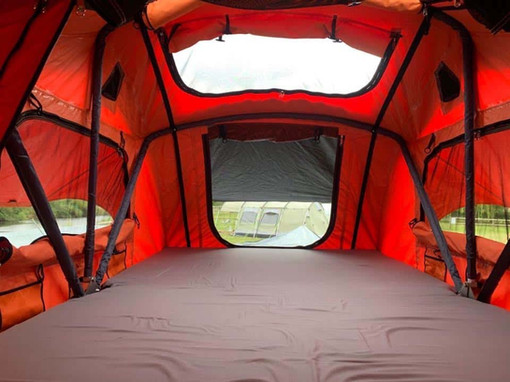
Find the location of a particular element. The height and width of the screenshot is (382, 510). windows is located at coordinates (64, 195), (484, 210), (305, 57).